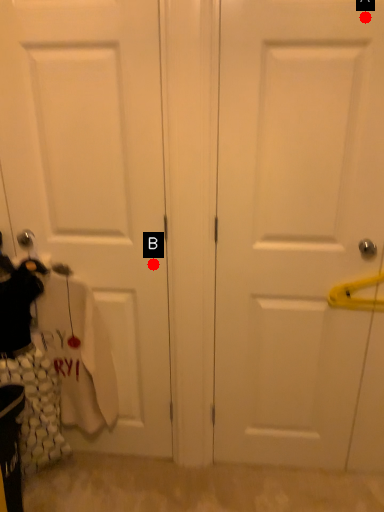
Question: Two points are circled on the image, labeled by A and B beside each circle. Which of the following is the farthest from the observer?

Choices:
 (A) A is further
 (B) B is further

Answer: (B)